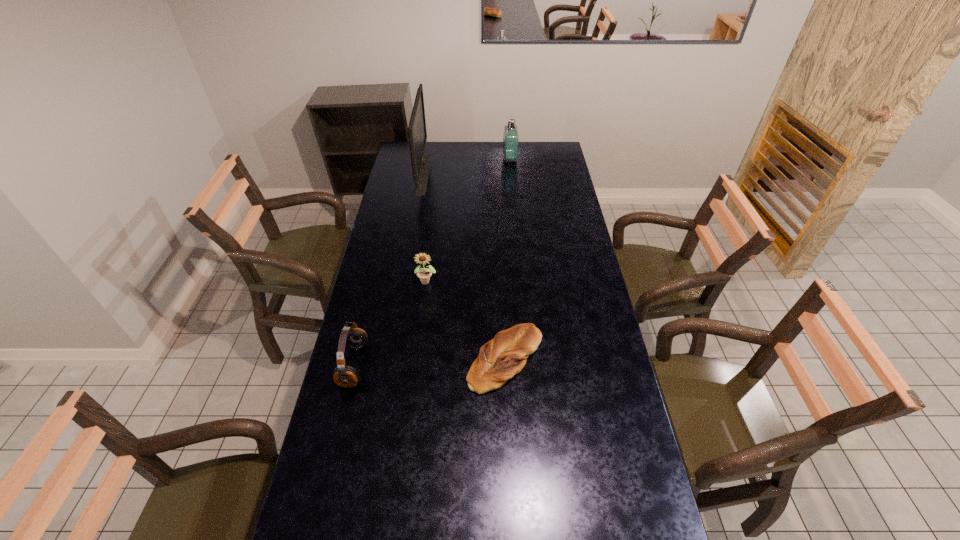
The height and width of the screenshot is (540, 960). In the image, there is a desktop. Identify the location of vacant area at the left edge. (379, 278).

Locate an element on the screen. The width and height of the screenshot is (960, 540). vacant point at the right edge is located at coordinates (592, 307).

The height and width of the screenshot is (540, 960). What are the coordinates of `unoccupied area between the fourth object from right to left and the perfume` in the screenshot? It's located at (467, 167).

You are a GUI agent. You are given a task and a screenshot of the screen. Output one action in this format:
    pyautogui.click(x=<x>, y=<y>)
    Task: Click on the free space between the leftmost object and the tallest object
    
    Given the screenshot: What is the action you would take?
    pyautogui.click(x=389, y=270)

Identify the location of vacant space that's between the third object from left to right and the shortest object. This screenshot has width=960, height=540. (466, 320).

In order to click on free spot between the leftmost object and the perfume in this screenshot , I will do `click(432, 262)`.

Identify the location of unoccupied area between the tallest object and the headset. This screenshot has width=960, height=540. (389, 270).

Find the location of a particular element. The image size is (960, 540). free space that is in between the leftmost object and the bread is located at coordinates (430, 362).

Find the location of a particular element. Image resolution: width=960 pixels, height=540 pixels. blank region between the perfume and the leftmost object is located at coordinates (432, 262).

Where is `free space between the headset and the bread`? free space between the headset and the bread is located at coordinates (430, 362).